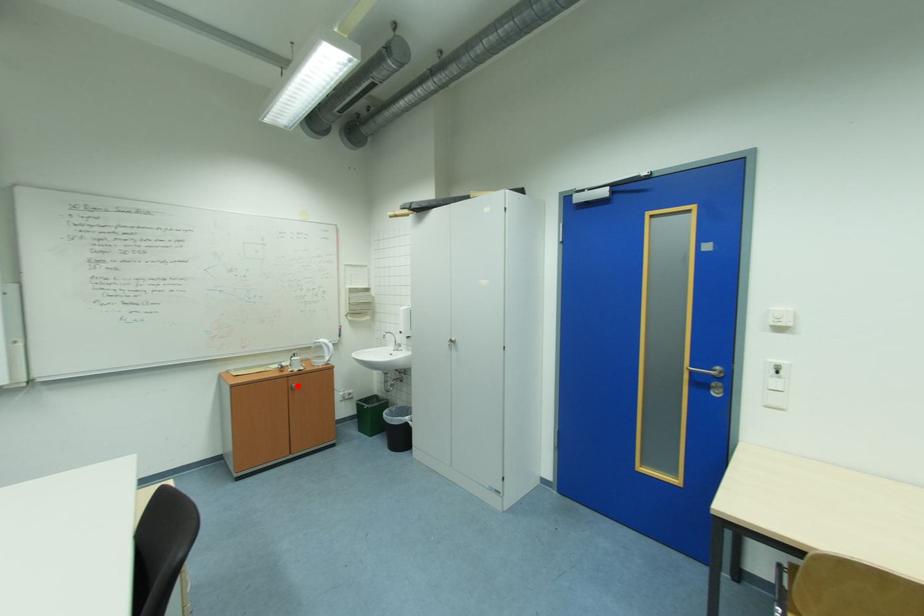
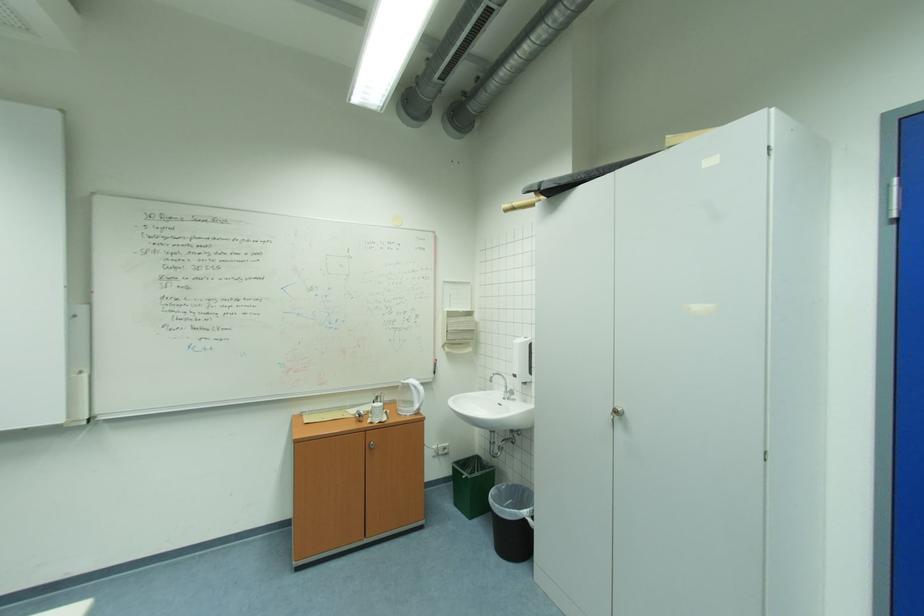
Question: I am providing you with two images of the same scene from different viewpoints. A red point is marked on the first image. Is the red point's position out of view in image 2?

Choices:
 (A) Yes
 (B) No

Answer: (B)